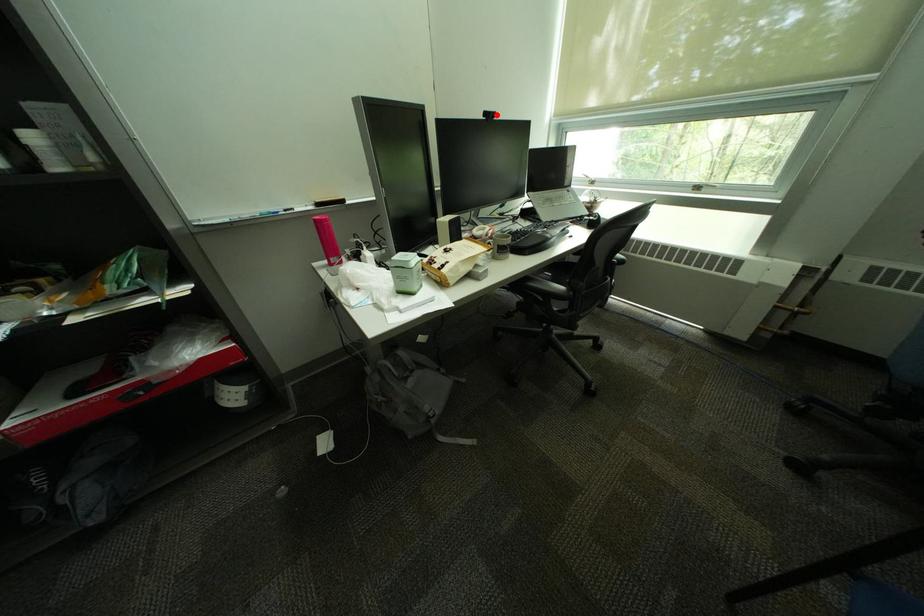
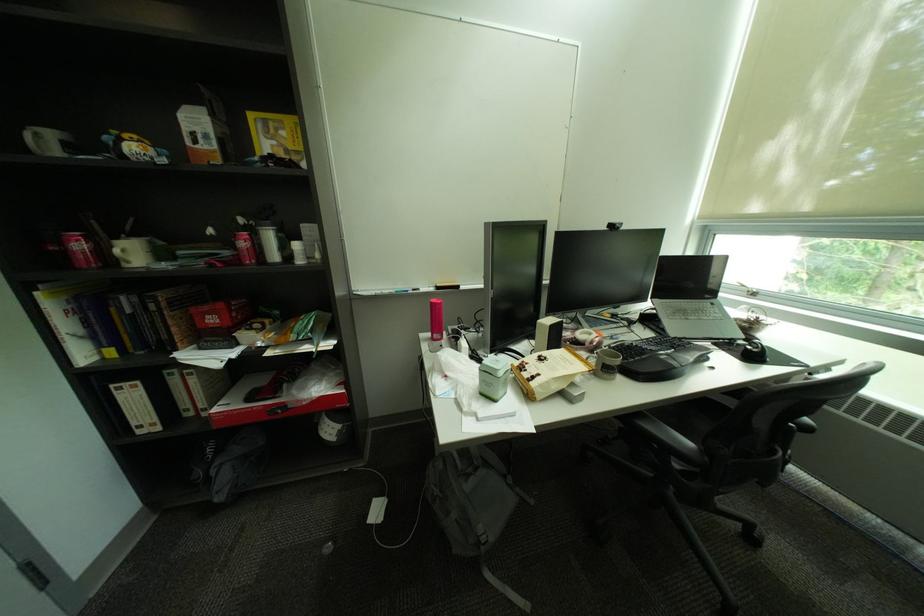
Find the pixel in the second image that matches the highlighted location in the first image.

(621, 227)